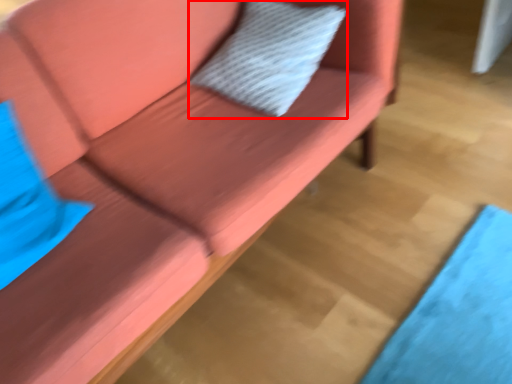
Question: Considering the relative positions of pillow (annotated by the red box) and pillow in the image provided, where is pillow (annotated by the red box) located with respect to the staircase?

Choices:
 (A) right
 (B) left

Answer: (A)